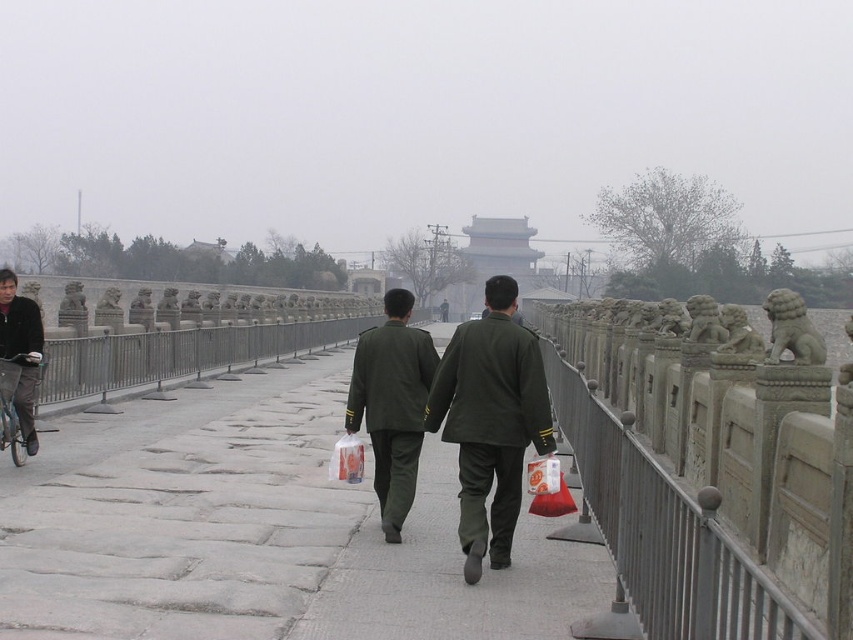
Between point (135, 508) and point (408, 397), which one is positioned in front?

Point (408, 397) is more forward.

Describe the element at coordinates (259, 532) in the screenshot. I see `gray stone pavement at center` at that location.

This screenshot has width=853, height=640. I want to click on gray stone pavement at center, so click(259, 532).

Based on the photo, who is more distant from viewer, (653, 568) or (442, 406)?

The point (442, 406) is behind.

Between gray stone railing at right and matte green uniform at center, which one is positioned higher?

gray stone railing at right is above.

In order to click on gray stone railing at right in this screenshot , I will do `click(706, 474)`.

The height and width of the screenshot is (640, 853). What are the coordinates of `gray stone railing at right` in the screenshot? It's located at (706, 474).

Can you confirm if gray stone pavement at center is smaller than gray stone railing at right?

Indeed, gray stone pavement at center has a smaller size compared to gray stone railing at right.

Is gray stone pavement at center thinner than gray stone railing at right?

No, gray stone pavement at center is not thinner than gray stone railing at right.

Who is more distant from viewer, (x=132, y=600) or (x=633, y=388)?

Positioned behind is point (x=633, y=388).

The width and height of the screenshot is (853, 640). Identify the location of gray stone pavement at center. (259, 532).